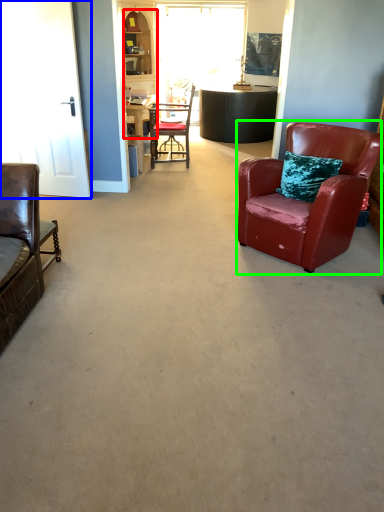
Question: Based on their relative distances, which object is farther from cabinetry (highlighted by a red box)? Choose from glass door (highlighted by a blue box) and chair (highlighted by a green box).

Choices:
 (A) glass door
 (B) chair

Answer: (B)